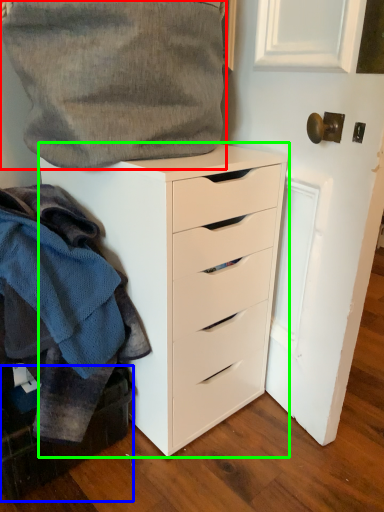
Question: Estimate the real-world distances between objects in this image. Which object is closer to gray (highlighted by a red box), cabinetry (highlighted by a blue box) or chest of drawers (highlighted by a green box)?

Choices:
 (A) cabinetry
 (B) chest of drawers

Answer: (B)